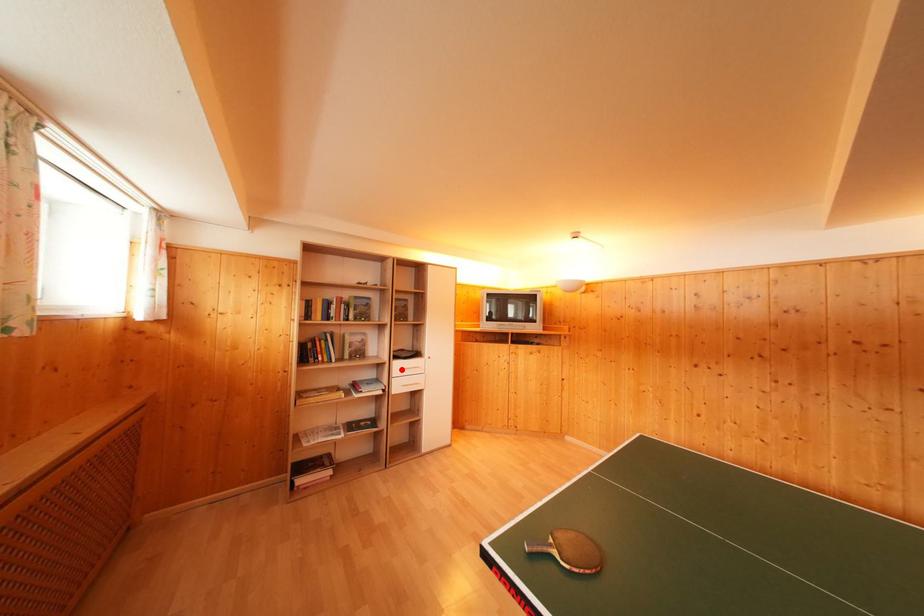
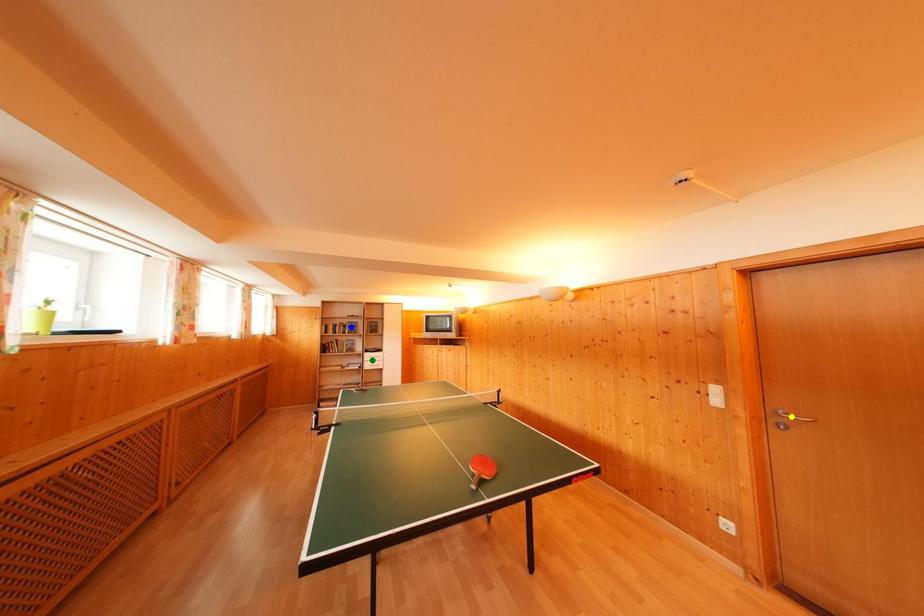
Question: I am providing you with two images of the same scene from different viewpoints. A red point is marked on the first image. You are given multiple points on the second image. In image 2, which mark is for the same physical point as the one in image 1?

Choices:
 (A) green point
 (B) blue point
 (C) yellow point

Answer: (A)